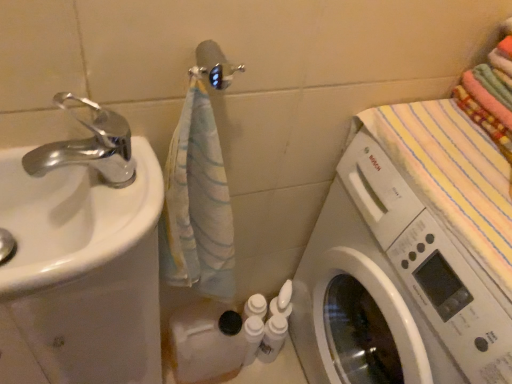
Locate an element on the screen. This screenshot has height=384, width=512. free spot above white glossy sink at left (from a real-world perspective) is located at coordinates (106, 191).